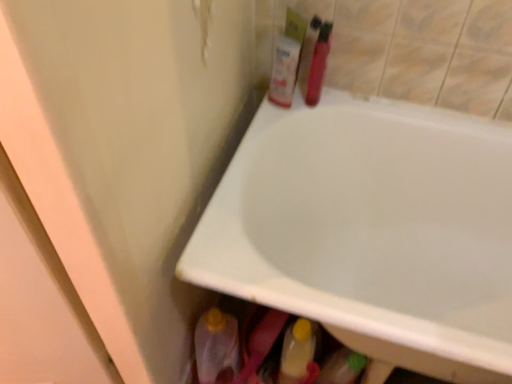
Question: Can yellow cap plastic bottle at lower center be found inside white glossy bathtub at upper center?

Choices:
 (A) yes
 (B) no

Answer: (A)

Question: Would you say white glossy bathtub at upper center is outside yellow cap plastic bottle at lower center?

Choices:
 (A) yes
 (B) no

Answer: (A)

Question: Can you confirm if white glossy bathtub at upper center is smaller than yellow cap plastic bottle at lower center?

Choices:
 (A) yes
 (B) no

Answer: (B)

Question: Is white glossy bathtub at upper center far away from yellow cap plastic bottle at lower center?

Choices:
 (A) no
 (B) yes

Answer: (A)

Question: From a real-world perspective, is white glossy bathtub at upper center on yellow cap plastic bottle at lower center?

Choices:
 (A) no
 (B) yes

Answer: (B)

Question: In the image, is yellow cap plastic bottle at lower center positioned in front of or behind shiny plastic bottle at upper right, which ranks as the 1th toiletry in right-to-left order?

Choices:
 (A) behind
 (B) front

Answer: (B)

Question: Based on their positions, is yellow cap plastic bottle at lower center located to the left or right of shiny plastic bottle at upper right, which ranks as the 1th toiletry in right-to-left order?

Choices:
 (A) right
 (B) left

Answer: (B)

Question: From the image's perspective, relative to shiny plastic bottle at upper right, which ranks as the 1th toiletry in right-to-left order, is yellow cap plastic bottle at lower center above or below?

Choices:
 (A) above
 (B) below

Answer: (B)

Question: Which is correct: yellow cap plastic bottle at lower center is inside shiny plastic bottle at upper right, which ranks as the 1th toiletry in right-to-left order, or outside of it?

Choices:
 (A) inside
 (B) outside

Answer: (B)

Question: Is shiny plastic bottle at upper right, which ranks as the 1th toiletry in right-to-left order, bigger or smaller than yellow cap plastic bottle at lower center?

Choices:
 (A) small
 (B) big

Answer: (A)

Question: Choose the correct answer: Is shiny plastic bottle at upper right, which ranks as the 1th toiletry in right-to-left order, inside yellow cap plastic bottle at lower center or outside it?

Choices:
 (A) outside
 (B) inside

Answer: (A)

Question: Does point (326, 49) appear closer or farther from the camera than point (289, 352)?

Choices:
 (A) closer
 (B) farther

Answer: (B)

Question: From a real-world perspective, relative to yellow cap plastic bottle at lower center, is shiny plastic bottle at upper right, which ranks as the 1th toiletry in right-to-left order, vertically above or below?

Choices:
 (A) below
 (B) above

Answer: (B)

Question: Is translucent plastic bottle at upper center, which is the 2th toiletry from right to left, wider or thinner than white glossy bathtub at upper center?

Choices:
 (A) thin
 (B) wide

Answer: (A)

Question: Is translucent plastic bottle at upper center, which is the 2th toiletry from right to left, bigger or smaller than white glossy bathtub at upper center?

Choices:
 (A) small
 (B) big

Answer: (A)